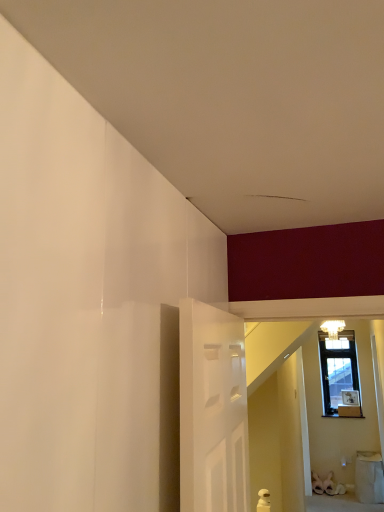
Describe the element at coordinates (369, 477) in the screenshot. I see `white fabric laundry basket at lower right` at that location.

This screenshot has height=512, width=384. What are the coordinates of `white fabric laundry basket at lower right` in the screenshot? It's located at (369, 477).

The height and width of the screenshot is (512, 384). What do you see at coordinates (333, 328) in the screenshot?
I see `matte white chandelier at upper center` at bounding box center [333, 328].

Image resolution: width=384 pixels, height=512 pixels. I want to click on matte white chandelier at upper center, so click(333, 328).

Find the location of a particular element. Image resolution: width=384 pixels, height=512 pixels. white fabric laundry basket at lower right is located at coordinates point(369,477).

Considering the positions of objects matte white chandelier at upper center and white fabric laundry basket at lower right in the image provided, who is more to the right, matte white chandelier at upper center or white fabric laundry basket at lower right?

white fabric laundry basket at lower right.

Is matte white chandelier at upper center positioned in front of white fabric laundry basket at lower right?

Yes, it is.

Which point is more forward, (328, 329) or (368, 483)?

Point (368, 483)

From the image's perspective, is matte white chandelier at upper center under white fabric laundry basket at lower right?

No, from the image's perspective, matte white chandelier at upper center is not below white fabric laundry basket at lower right.

From a real-world perspective, is matte white chandelier at upper center on top of white fabric laundry basket at lower right?

Yes, from a real-world perspective, matte white chandelier at upper center is above white fabric laundry basket at lower right.

Considering the sizes of objects matte white chandelier at upper center and white fabric laundry basket at lower right in the image provided, who is thinner, matte white chandelier at upper center or white fabric laundry basket at lower right?

matte white chandelier at upper center is thinner.

Can you confirm if matte white chandelier at upper center is taller than white fabric laundry basket at lower right?

In fact, matte white chandelier at upper center may be shorter than white fabric laundry basket at lower right.

Considering the relative sizes of matte white chandelier at upper center and white fabric laundry basket at lower right in the image provided, is matte white chandelier at upper center smaller than white fabric laundry basket at lower right?

Yes, matte white chandelier at upper center is smaller than white fabric laundry basket at lower right.

Could white fabric laundry basket at lower right be considered to be inside matte white chandelier at upper center?

No, white fabric laundry basket at lower right is not a part of matte white chandelier at upper center.

Would you say matte white chandelier at upper center is a long distance from white fabric laundry basket at lower right?

That's right, there is a large distance between matte white chandelier at upper center and white fabric laundry basket at lower right.

Is matte white chandelier at upper center positioned with its back to white fabric laundry basket at lower right?

matte white chandelier at upper center does not have its back to white fabric laundry basket at lower right.

I want to click on light fixture on the left side of white fabric laundry basket at lower right, so click(333, 328).

Is white fabric laundry basket at lower right to the left or to the right of matte white chandelier at upper center in the image?

From the image, it's evident that white fabric laundry basket at lower right is to the right of matte white chandelier at upper center.

Consider the image. Between white fabric laundry basket at lower right and matte white chandelier at upper center, which one is positioned behind?

white fabric laundry basket at lower right is behind.

Does point (367, 500) appear closer or farther from the camera than point (335, 320)?

Point (367, 500) is positioned farther from the camera compared to point (335, 320).

From the image's perspective, between white fabric laundry basket at lower right and matte white chandelier at upper center, which one is located above?

matte white chandelier at upper center is shown above in the image.

From a real-world perspective, which object rests below the other?

white fabric laundry basket at lower right.

Which object is thinner, white fabric laundry basket at lower right or matte white chandelier at upper center?

matte white chandelier at upper center.

Is white fabric laundry basket at lower right taller than matte white chandelier at upper center?

Indeed, white fabric laundry basket at lower right has a greater height compared to matte white chandelier at upper center.

Is white fabric laundry basket at lower right smaller than matte white chandelier at upper center?

Incorrect, white fabric laundry basket at lower right is not smaller in size than matte white chandelier at upper center.

Choose the correct answer: Is white fabric laundry basket at lower right inside matte white chandelier at upper center or outside it?

white fabric laundry basket at lower right lies outside matte white chandelier at upper center.

Is there a large distance between white fabric laundry basket at lower right and matte white chandelier at upper center?

Indeed, white fabric laundry basket at lower right is not near matte white chandelier at upper center.

Is white fabric laundry basket at lower right turned away from matte white chandelier at upper center?

No, white fabric laundry basket at lower right is not facing the opposite direction of matte white chandelier at upper center.

How many degrees apart are the facing directions of white fabric laundry basket at lower right and matte white chandelier at upper center?

The angular difference between white fabric laundry basket at lower right and matte white chandelier at upper center is 1.3 degrees.

What are the coordinates of `light fixture above the white fabric laundry basket at lower right (from the image's perspective)` in the screenshot? It's located at (333, 328).

At what (x,y) coordinates should I click in order to perform the action: click on furniture on the right of matte white chandelier at upper center. Please return your answer as a coordinate pair (x, y). The height and width of the screenshot is (512, 384). Looking at the image, I should click on (369, 477).

Where is `light fixture in front of the white fabric laundry basket at lower right`? light fixture in front of the white fabric laundry basket at lower right is located at coordinates (333, 328).